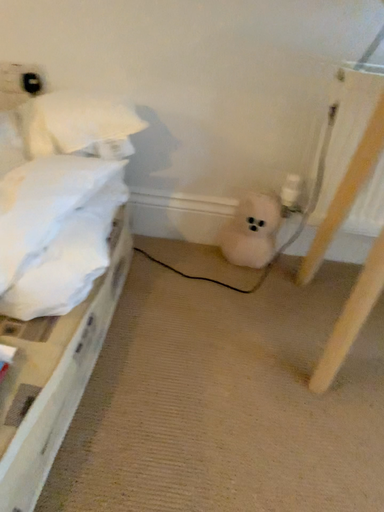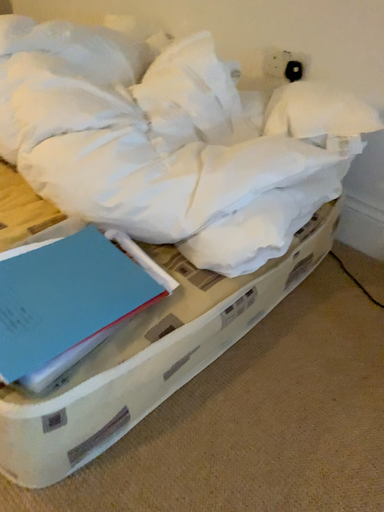
Question: How did the camera likely rotate when shooting the video?

Choices:
 (A) rotated left
 (B) rotated right

Answer: (A)